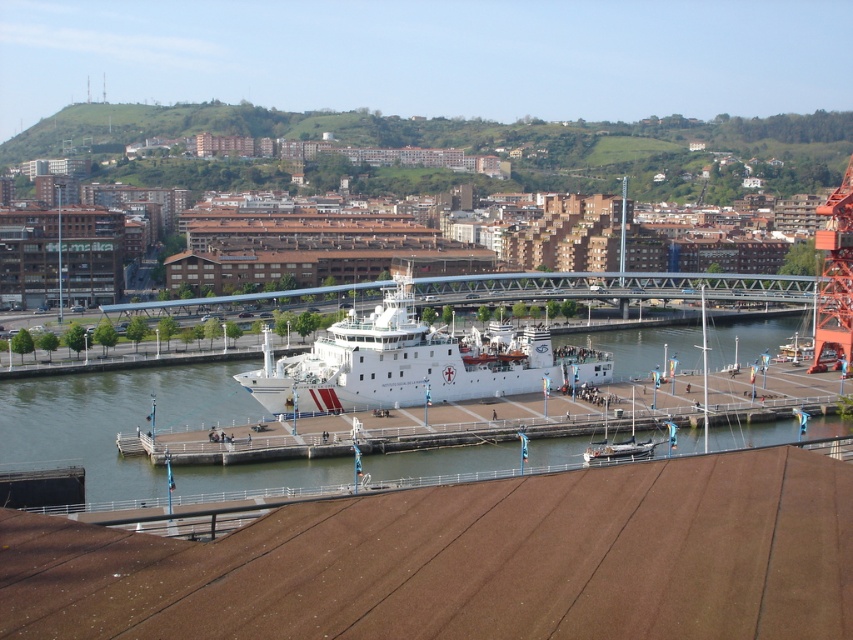
Question: Is brown wooden dock at lower center closer to camera compared to metallic gray bridge at center?

Choices:
 (A) no
 (B) yes

Answer: (B)

Question: Can you confirm if clear water at center is positioned above wooden sailboat at center?

Choices:
 (A) no
 (B) yes

Answer: (B)

Question: Estimate the real-world distances between objects in this image. Which object is closer to the white matte ship at center?

Choices:
 (A) metallic gray bridge at center
 (B) clear water at center
 (C) wooden sailboat at center

Answer: (B)

Question: Does brown wooden dock at lower center come behind white matte ship at center?

Choices:
 (A) no
 (B) yes

Answer: (A)

Question: Among these points, which one is nearest to the camera?

Choices:
 (A) (753, 355)
 (B) (341, 397)
 (C) (97, 621)
 (D) (628, 442)

Answer: (C)

Question: Which of the following is the farthest from the observer?

Choices:
 (A) (585, 449)
 (B) (42, 444)
 (C) (378, 333)

Answer: (C)